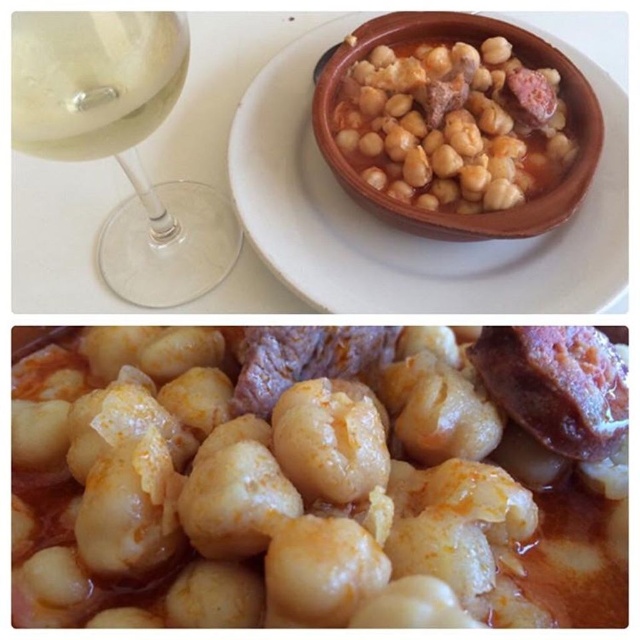
Question: In this image, where is transparent glass wine at upper left located relative to terracotta bowl at upper center?

Choices:
 (A) below
 (B) above

Answer: (A)

Question: Which point appears farthest from the camera in this image?

Choices:
 (A) (232, 264)
 (B) (192, 387)

Answer: (A)

Question: Can you confirm if glossy white gnocchi at center is positioned below clear glass wine at top left?

Choices:
 (A) yes
 (B) no

Answer: (A)

Question: Which is farther from the glossy white gnocchi at center?

Choices:
 (A) transparent glass wine at upper left
 (B) terracotta bowl at upper center

Answer: (B)

Question: Does glossy white gnocchi at center appear over clear glass wine at top left?

Choices:
 (A) no
 (B) yes

Answer: (A)

Question: Among these objects, which one is farthest from the camera?

Choices:
 (A) clear glass wine at top left
 (B) transparent glass wine at upper left

Answer: (B)